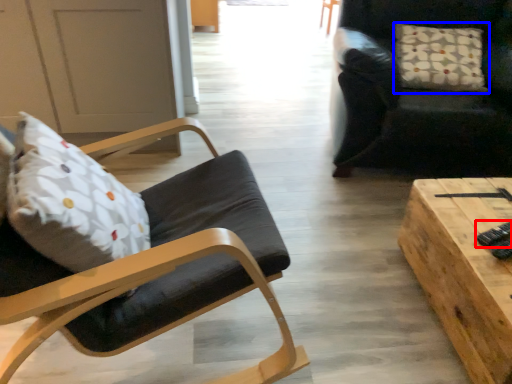
Question: Among these objects, which one is nearest to the camera, remote control (highlighted by a red box) or pillow (highlighted by a blue box)?

Choices:
 (A) remote control
 (B) pillow

Answer: (A)